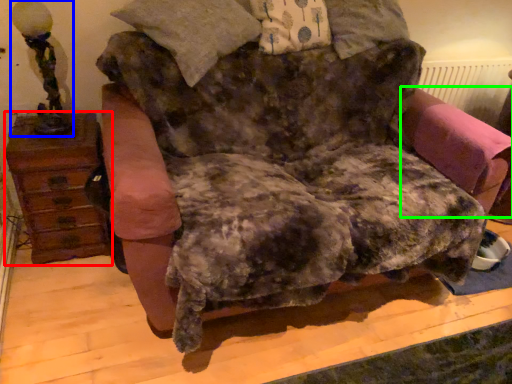
Question: Which object is positioned closest to furniture (highlighted by a red box)? Select from table lamp (highlighted by a blue box) and swivel chair (highlighted by a green box).

Choices:
 (A) table lamp
 (B) swivel chair

Answer: (A)